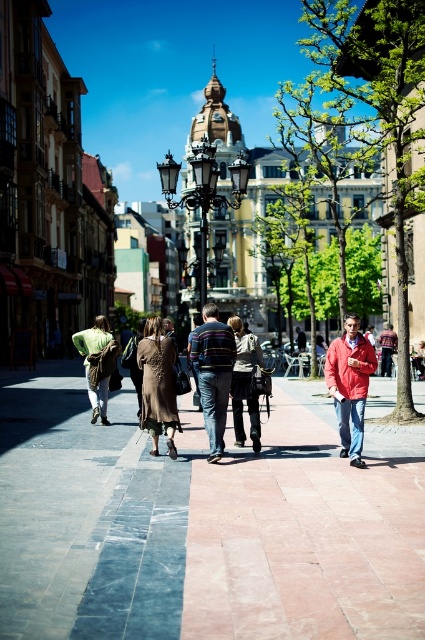
Is marble pavement at center shorter than dark brown leather jacket at center?

Yes, marble pavement at center is shorter than dark brown leather jacket at center.

Can you confirm if marble pavement at center is positioned to the right of dark brown leather jacket at center?

In fact, marble pavement at center is to the left of dark brown leather jacket at center.

Locate an element on the screen. The height and width of the screenshot is (640, 425). marble pavement at center is located at coordinates (203, 522).

Locate an element on the screen. The image size is (425, 640). marble pavement at center is located at coordinates (203, 522).

Looking at this image, is striped cotton shirt at center wider than green fabric bag at center?

No.

Can you confirm if striped cotton shirt at center is positioned to the right of green fabric bag at center?

Correct, you'll find striped cotton shirt at center to the right of green fabric bag at center.

Which is in front, point (224, 380) or point (107, 339)?

Point (224, 380) is in front.

Find the location of `striped cotton shirt at center`. striped cotton shirt at center is located at coordinates (x=212, y=374).

Who is positioned more to the left, marble pavement at center or green fabric bag at center?

Positioned to the left is green fabric bag at center.

Describe the element at coordinates (203, 522) in the screenshot. I see `marble pavement at center` at that location.

At what (x,y) coordinates should I click in order to perform the action: click on marble pavement at center. Please return your answer as a coordinate pair (x, y). Looking at the image, I should click on (203, 522).